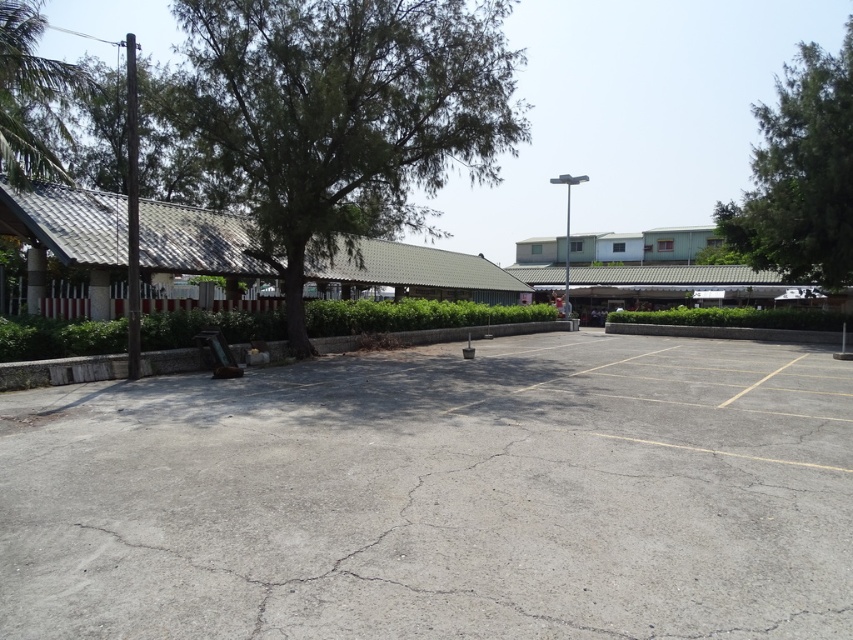
You are standing at the edge of the gray asphalt parking lot at center and want to find shade. Which direction should you walk to reach the nearest shaded area provided by the green leafy tree at upper right?

The gray asphalt parking lot at center is positioned under the green leafy tree at upper right, so walking towards the upper right direction will lead you to the shaded area provided by the green leafy tree at upper right.

You are standing at the entrance of the building and want to walk towards the green leafy tree at upper right. Which direction should you turn to avoid the green leafy tree at center?

You should turn to the right to avoid the green leafy tree at center, as it is to the left of the green leafy tree at upper right.